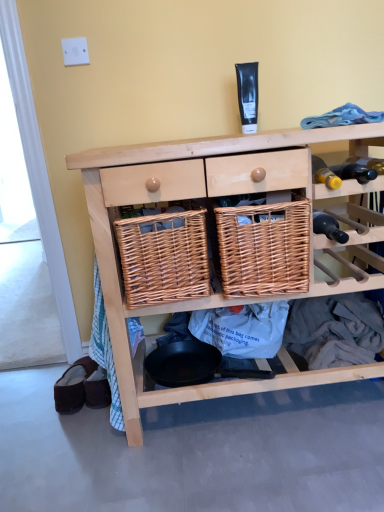
Question: Is woven brown basket at center, the 2th basket viewed from the right, oriented away from natural wood wicker baskets at center?

Choices:
 (A) yes
 (B) no

Answer: (A)

Question: Considering the relative positions of woven brown basket at center, the 2th basket viewed from the right, and natural wood wicker baskets at center in the image provided, is woven brown basket at center, the 2th basket viewed from the right, to the right of natural wood wicker baskets at center from the viewer's perspective?

Choices:
 (A) no
 (B) yes

Answer: (A)

Question: Does woven brown basket at center, which is counted as the first basket, starting from the left, appear on the left side of natural wood wicker baskets at center?

Choices:
 (A) no
 (B) yes

Answer: (B)

Question: Does woven brown basket at center, which is counted as the first basket, starting from the left, have a greater width compared to natural wood wicker baskets at center?

Choices:
 (A) yes
 (B) no

Answer: (B)

Question: From the image's perspective, is woven brown basket at center, the 2th basket viewed from the right, located above natural wood wicker baskets at center?

Choices:
 (A) yes
 (B) no

Answer: (A)

Question: Considering the relative sizes of woven brown basket at center, the 2th basket viewed from the right, and natural wood wicker baskets at center in the image provided, is woven brown basket at center, the 2th basket viewed from the right, taller than natural wood wicker baskets at center?

Choices:
 (A) yes
 (B) no

Answer: (B)

Question: From the image's perspective, is brown suede slippers at lower left located beneath natural wood wicker baskets at center?

Choices:
 (A) yes
 (B) no

Answer: (A)

Question: Does brown suede slippers at lower left lie behind natural wood wicker baskets at center?

Choices:
 (A) yes
 (B) no

Answer: (A)

Question: Is brown suede slippers at lower left thinner than natural wood wicker baskets at center?

Choices:
 (A) no
 (B) yes

Answer: (B)

Question: Does brown suede slippers at lower left have a greater width compared to natural wood wicker baskets at center?

Choices:
 (A) no
 (B) yes

Answer: (A)

Question: Considering the relative positions of brown suede slippers at lower left and natural wood wicker baskets at center in the image provided, is brown suede slippers at lower left to the right of natural wood wicker baskets at center from the viewer's perspective?

Choices:
 (A) yes
 (B) no

Answer: (B)

Question: Is brown suede slippers at lower left in front of natural wood wicker baskets at center?

Choices:
 (A) yes
 (B) no

Answer: (B)

Question: Could you tell me if woven brown basket at center, which appears as the first basket when viewed from the right, is facing black matte tube at upper center?

Choices:
 (A) no
 (B) yes

Answer: (A)